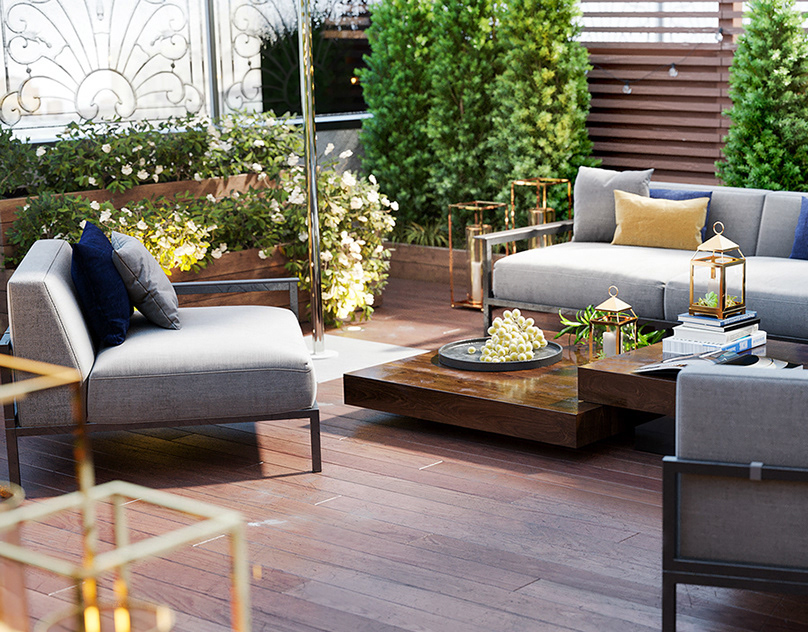
You are a GUI agent. You are given a task and a screenshot of the screen. Output one action in this format:
    pyautogui.click(x=<x>, y=<y>)
    Task: Click on the flooring wooden
    Image resolution: width=808 pixels, height=632 pixels.
    Given the screenshot: What is the action you would take?
    pyautogui.click(x=440, y=533)